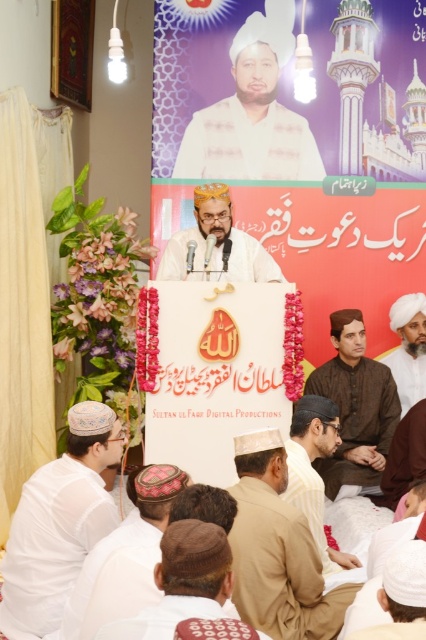
Who is more forward, (222, 529) or (316, 444)?

Positioned in front is point (222, 529).

Can you confirm if brown textured hat at lower center is shorter than light brown fabric cap at center?

Indeed, brown textured hat at lower center has a lesser height compared to light brown fabric cap at center.

Identify the location of brown textured hat at lower center. (183, 582).

Between point (423, 604) and point (414, 356), which one is positioned behind?

Positioned behind is point (414, 356).

Who is lower down, white cotton turban at lower center or white matte turban at center?

white cotton turban at lower center

Where is `white cotton turban at lower center`? white cotton turban at lower center is located at coordinates (391, 596).

Where is `white cotton turban at lower center`? white cotton turban at lower center is located at coordinates (391, 596).

Is matte gold crown at center to the right of white matte turban at center from the viewer's perspective?

Incorrect, matte gold crown at center is not on the right side of white matte turban at center.

Who is more forward, (259, 264) or (389, 355)?

Point (259, 264)

This screenshot has width=426, height=640. I want to click on matte gold crown at center, so click(216, 244).